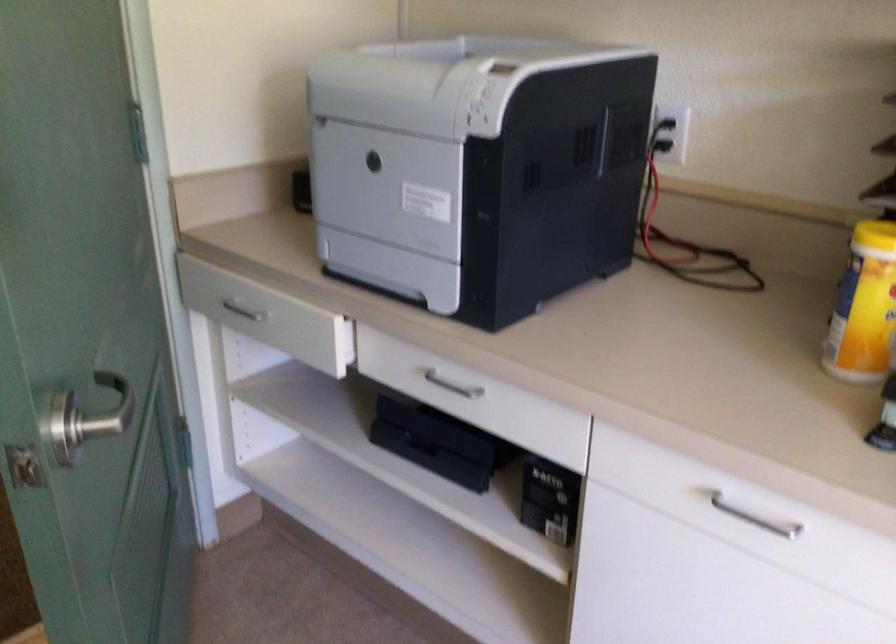
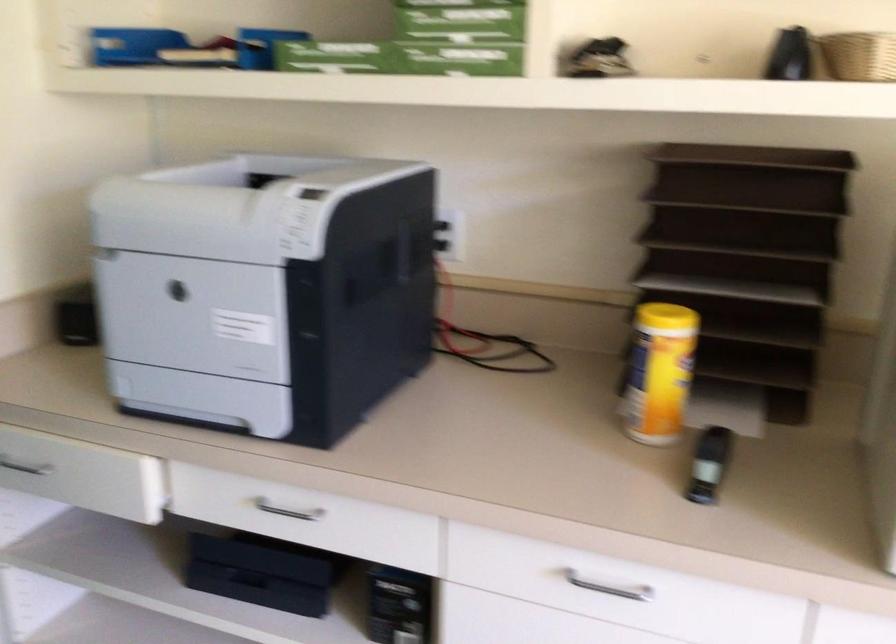
The point at (240, 313) is marked in the first image. Where is the corresponding point in the second image?

(24, 467)